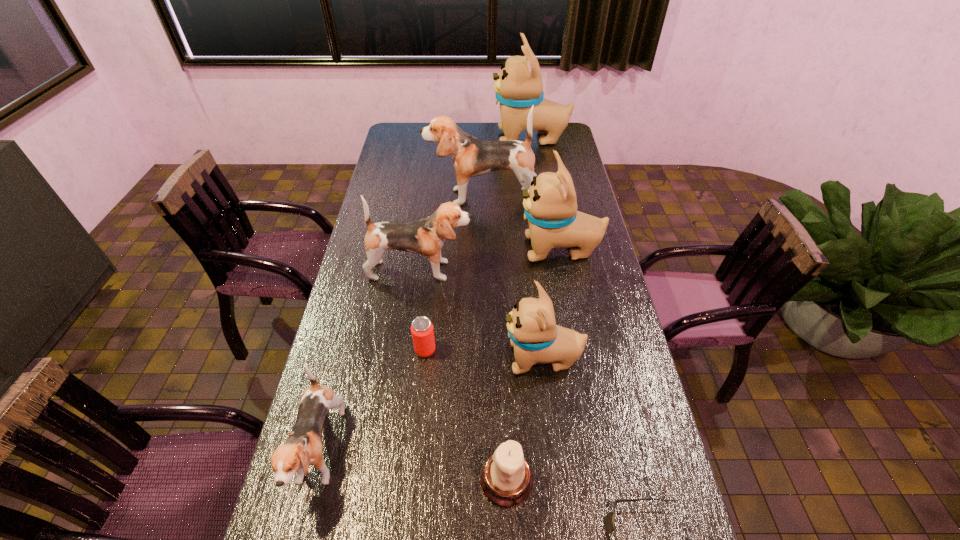
At what (x,y) coordinates should I click in order to perform the action: click on the third shortest object. Please return your answer as a coordinate pair (x, y). The image size is (960, 540). Looking at the image, I should click on (506, 478).

Locate an element on the screen. Image resolution: width=960 pixels, height=540 pixels. white candle holder is located at coordinates (506, 478).

The width and height of the screenshot is (960, 540). I want to click on red beer can, so click(422, 331).

Identify the location of the second shortest object. (422, 331).

Locate an element on the screen. Image resolution: width=960 pixels, height=540 pixels. vacant space located 0.360m on the face of the farthest beige puppy is located at coordinates (418, 139).

Find the location of a particular element. free space located on the face of the farthest beige puppy is located at coordinates (452, 139).

Where is `free space located 0.120m on the face of the farthest beige puppy`? The image size is (960, 540). free space located 0.120m on the face of the farthest beige puppy is located at coordinates (468, 139).

At what (x,y) coordinates should I click in order to perform the action: click on vacant space located 0.100m at the face of the biggest brown puppy. Please return your answer as a coordinate pair (x, y). This screenshot has height=540, width=960. Looking at the image, I should click on (402, 197).

Find the location of a particular element. Image resolution: width=960 pixels, height=540 pixels. vacant position located 0.150m at the face of the biggest brown puppy is located at coordinates (390, 197).

Locate an element on the screen. The width and height of the screenshot is (960, 540). free space located 0.220m at the face of the biggest brown puppy is located at coordinates [372, 197].